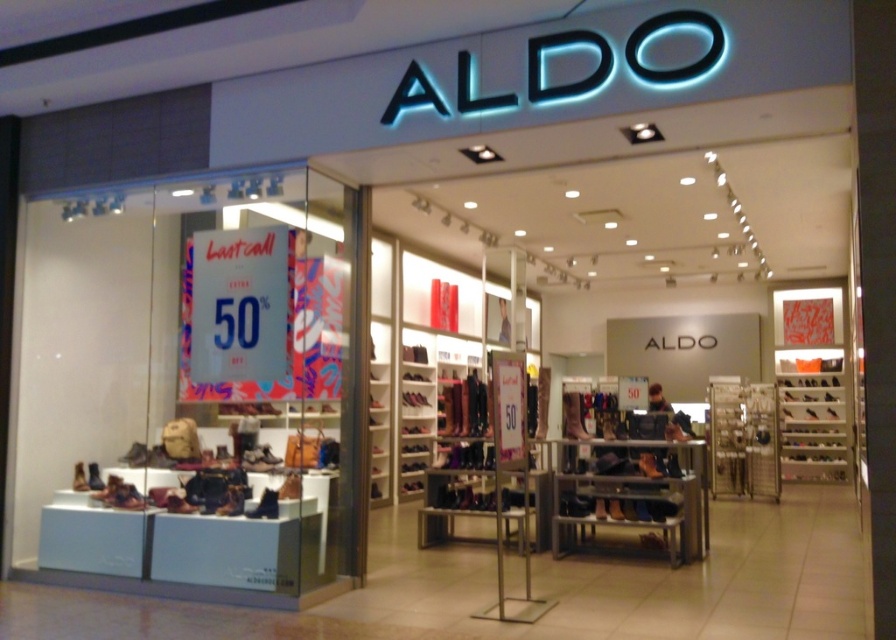
You are standing at the entrance of the Aldo store looking inside. You notice two points marked on the floor at coordinates point (175, 509) and point (89, 483). Which point is closer to you as you face the store entrance?

Point (175, 509) is in front of point (89, 483), so it is closer to you as you face the store entrance.

You are standing at the entrance of the Aldo store and want to pick up the matte brown shoe at lower left and the matte brown boot at center. Since you can only carry one item at a time, which item should you pick first if you want to minimize the total distance you walk?

You should pick up the matte brown shoe at lower left first because it is closer to the entrance than the matte brown boot at center, so picking it first would reduce the total distance walked.

You are standing outside the Aldo store entrance and want to know how far the point at coordinates point (655, 472) is from you. Can you determine the distance?

The distance of point (655, 472) from viewer is 6.75 meters.